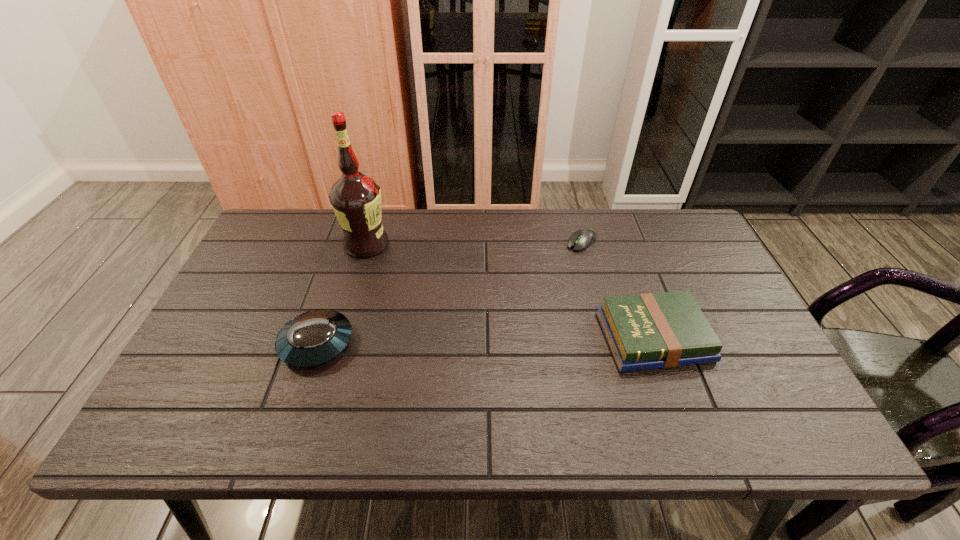
This screenshot has width=960, height=540. I want to click on free spot located on the label of the alcohol, so click(x=467, y=324).

Locate an element on the screen. The width and height of the screenshot is (960, 540). free space located 0.170m on the label of the alcohol is located at coordinates (416, 283).

The width and height of the screenshot is (960, 540). What are the coordinates of `computer mouse that is at the far edge` in the screenshot? It's located at (583, 238).

This screenshot has width=960, height=540. In order to click on alcohol located at the far edge in this screenshot , I will do `click(356, 198)`.

At what (x,y) coordinates should I click in order to perform the action: click on saucer located at the near edge. Please return your answer as a coordinate pair (x, y). Looking at the image, I should click on (313, 338).

Identify the location of book present at the near edge. The height and width of the screenshot is (540, 960). (646, 331).

Image resolution: width=960 pixels, height=540 pixels. Identify the location of object that is at the right edge. (646, 331).

The image size is (960, 540). Identify the location of object that is at the near right corner. (646, 331).

What are the coordinates of `vacant space at the far edge` in the screenshot? It's located at (462, 235).

This screenshot has width=960, height=540. In order to click on vacant space at the near edge in this screenshot , I will do `click(337, 402)`.